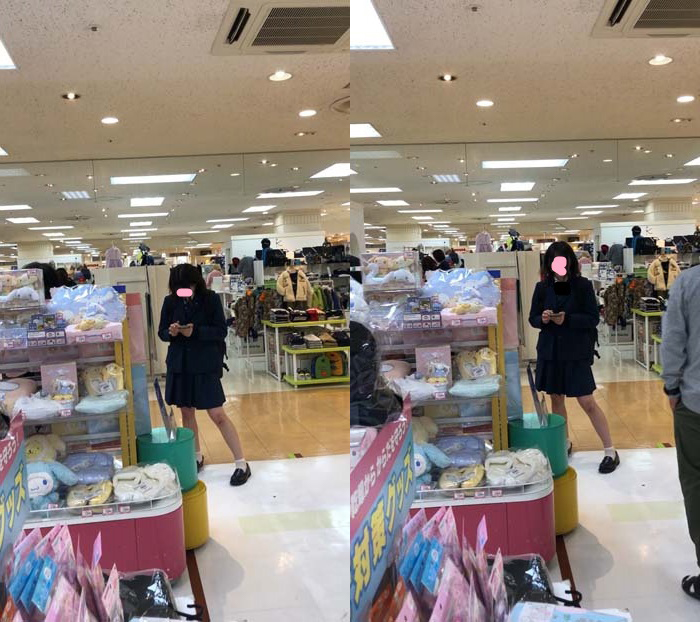
This screenshot has height=622, width=700. I want to click on shelf, so click(477, 337), click(113, 434).